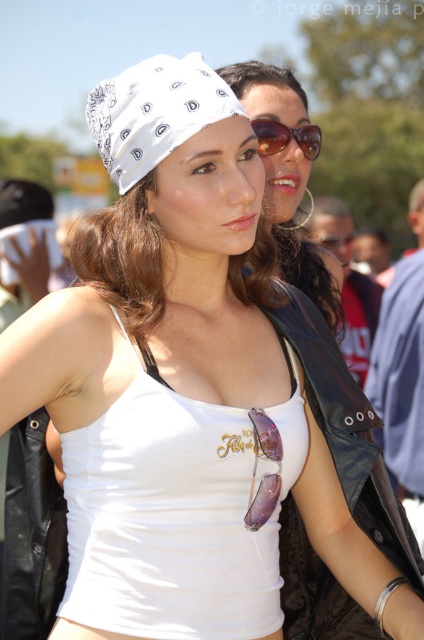
You are a photographer trying to capture a clear shot of both the matte black sunglasses at upper center and the white printed bandana at upper center. Which object is closer to the camera and will appear larger in the photo?

The matte black sunglasses at upper center is closer to the camera than the white printed bandana at upper center, so it will appear larger in the photo.

You are a photographer trying to capture both the matte black sunglasses at upper center and the white printed bandana at upper center in the same frame. Which object should you focus on first to ensure both are in the frame?

You should focus on the matte black sunglasses at upper center first because it is larger in size than the white printed bandana at upper center, ensuring both fit within the frame by prioritizing the larger object.

You are a photographer trying to capture both the shiny black leather jacket at center and the sunglasses at center in a single frame. Given that your camera has a fixed focus that can only accommodate objects of the same width, will you need to adjust your framing to include both?

The shiny black leather jacket at center is wider than the sunglasses at center. Since the camera requires objects of the same width to be in focus, you will need to adjust your framing to ensure both are properly captured.